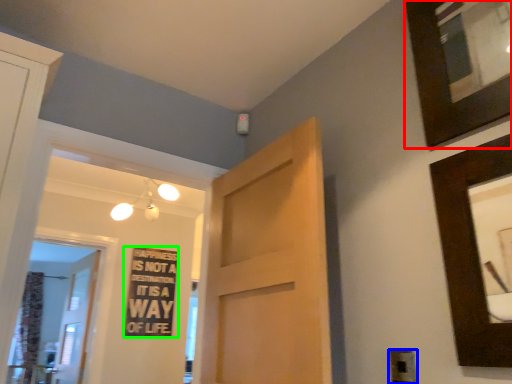
Question: Which is nearer to the picture frame (highlighted by a red box)? electric outlet (highlighted by a blue box) or warning sign (highlighted by a green box).

Choices:
 (A) electric outlet
 (B) warning sign

Answer: (A)